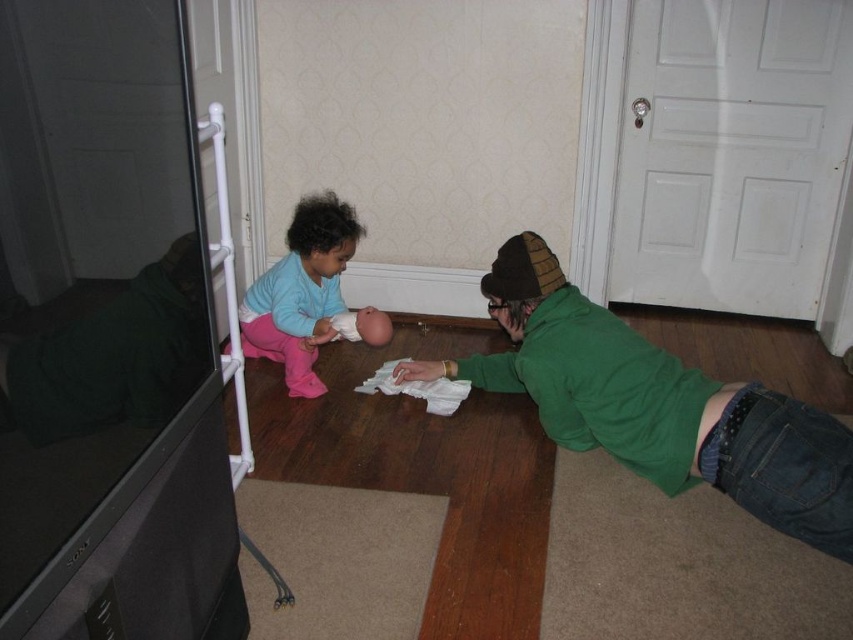
How distant is green soft sweater at lower right from matte blue sweater at center?

83.16 centimeters

Identify the location of green soft sweater at lower right. The height and width of the screenshot is (640, 853). (654, 404).